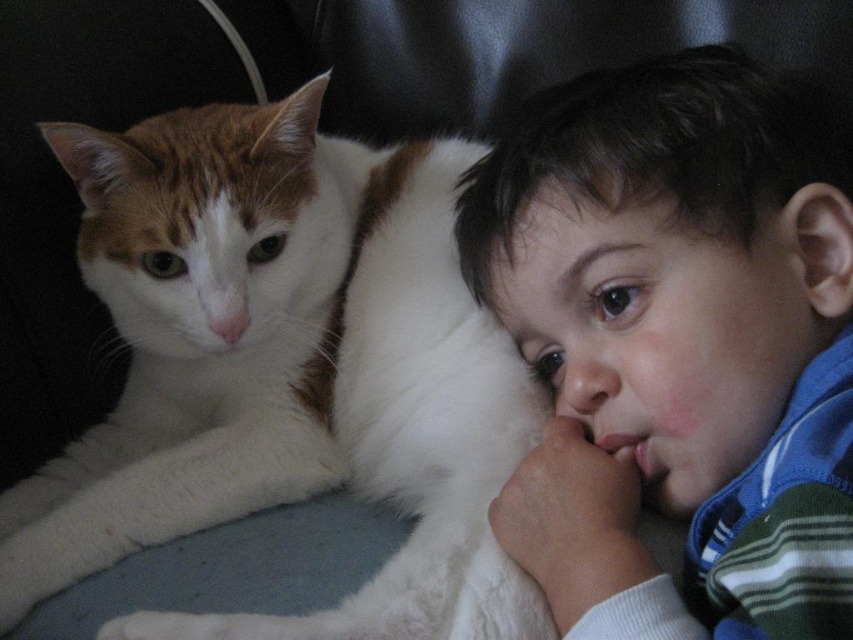
Question: Does white soft fur cat at left appear under smooth blue striped shirt at right?

Choices:
 (A) yes
 (B) no

Answer: (A)

Question: Which object appears farthest from the camera in this image?

Choices:
 (A) smooth blue striped shirt at right
 (B) white soft fur cat at left

Answer: (B)

Question: Which of the following is the farthest from the observer?

Choices:
 (A) click(x=218, y=616)
 (B) click(x=712, y=353)

Answer: (B)

Question: Is the position of white soft fur cat at left less distant than that of smooth blue striped shirt at right?

Choices:
 (A) no
 (B) yes

Answer: (A)

Question: Is white soft fur cat at left further to camera compared to smooth blue striped shirt at right?

Choices:
 (A) no
 (B) yes

Answer: (B)